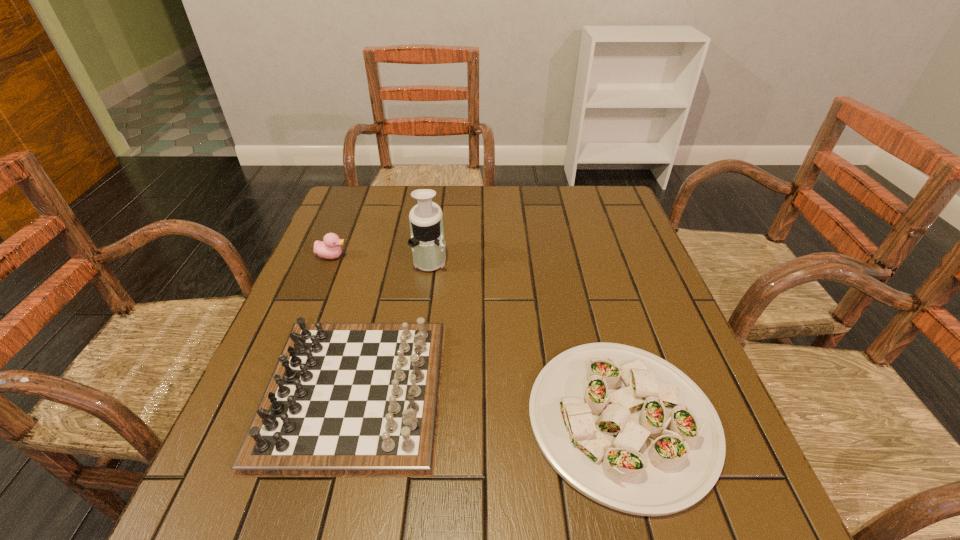
Locate an element on the screen. This screenshot has height=540, width=960. free space that satisfies the following two spatial constraints: 1. on the back side of the platter; 2. on the front-facing side of the duckling is located at coordinates (578, 256).

You are a GUI agent. You are given a task and a screenshot of the screen. Output one action in this format:
    pyautogui.click(x=<x>, y=<y>)
    Task: Click on the vacant space that satisfies the following two spatial constraints: 1. on the front-facing side of the rightmost object; 2. on the right side of the duckling
    The image size is (960, 540).
    Given the screenshot: What is the action you would take?
    pyautogui.click(x=266, y=419)

At what (x,y) coordinates should I click in order to perform the action: click on free space that satisfies the following two spatial constraints: 1. on the front-facing side of the duckling; 2. on the right side of the shortest object. Please return your answer as a coordinate pair (x, y). The width and height of the screenshot is (960, 540). Looking at the image, I should click on (266, 419).

I want to click on vacant space that satisfies the following two spatial constraints: 1. from the player's perspective of the chessboard; 2. on the left side of the shortest object, so click(348, 419).

Find the location of a particular element. Image resolution: width=960 pixels, height=540 pixels. free space that satisfies the following two spatial constraints: 1. on the front-facing side of the duckling; 2. on the back side of the platter is located at coordinates (266, 419).